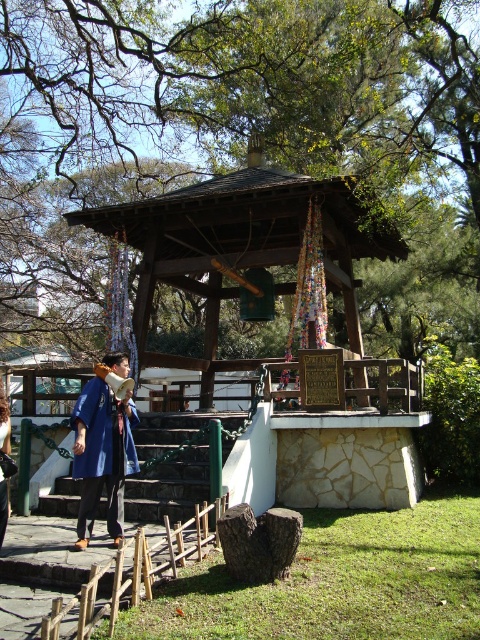
The image size is (480, 640). What do you see at coordinates (240, 140) in the screenshot?
I see `green leafy tree at upper center` at bounding box center [240, 140].

Is green leafy tree at upper center above blue fabric coat at center?

Correct, green leafy tree at upper center is located above blue fabric coat at center.

Where is `green leafy tree at upper center`? The image size is (480, 640). green leafy tree at upper center is located at coordinates (240, 140).

Can you confirm if green leafy tree at upper center is positioned to the left of green stone stairs at center?

Yes, green leafy tree at upper center is to the left of green stone stairs at center.

Between green leafy tree at upper center and green stone stairs at center, which one is positioned higher?

green leafy tree at upper center

Is point (84, 289) less distant than point (164, 460)?

No, (84, 289) is behind (164, 460).

Locate an element on the screen. green leafy tree at upper center is located at coordinates (240, 140).

Which of these two, green leafy tree at upper center or wooden gazebo at center, stands taller?

Standing taller between the two is green leafy tree at upper center.

Can you confirm if green leafy tree at upper center is wider than wooden gazebo at center?

Correct, the width of green leafy tree at upper center exceeds that of wooden gazebo at center.

Does point (326, 145) come closer to viewer compared to point (158, 248)?

That is False.

Find the location of a particular element. green leafy tree at upper center is located at coordinates (240, 140).